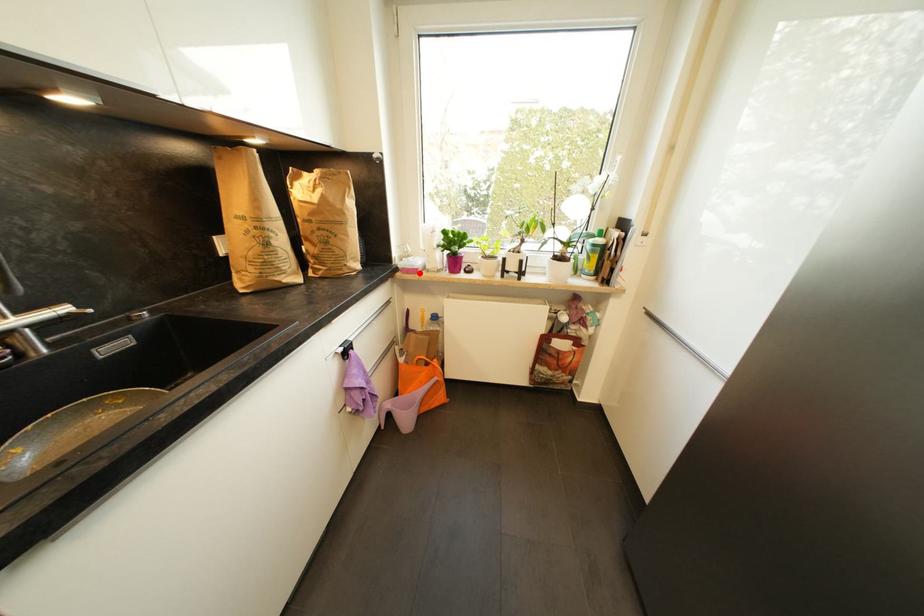
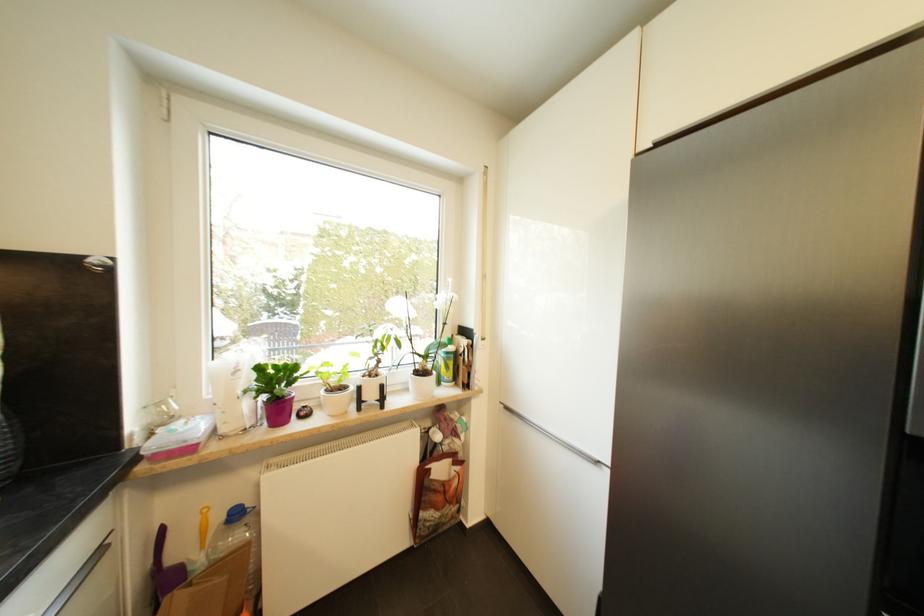
Find the pixel in the second image that matches the highlighted location in the first image.

(195, 451)